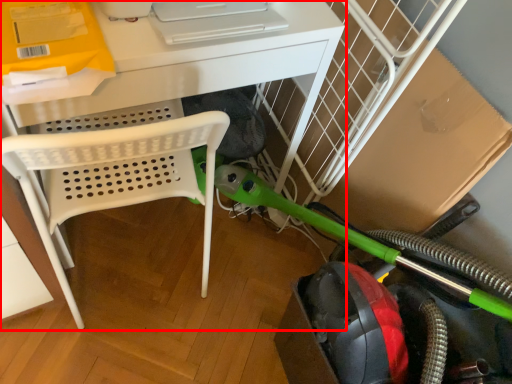
Question: From the image's perspective, what is the correct spatial positioning of desk (annotated by the red box) in reference to garden hose?

Choices:
 (A) above
 (B) below

Answer: (A)